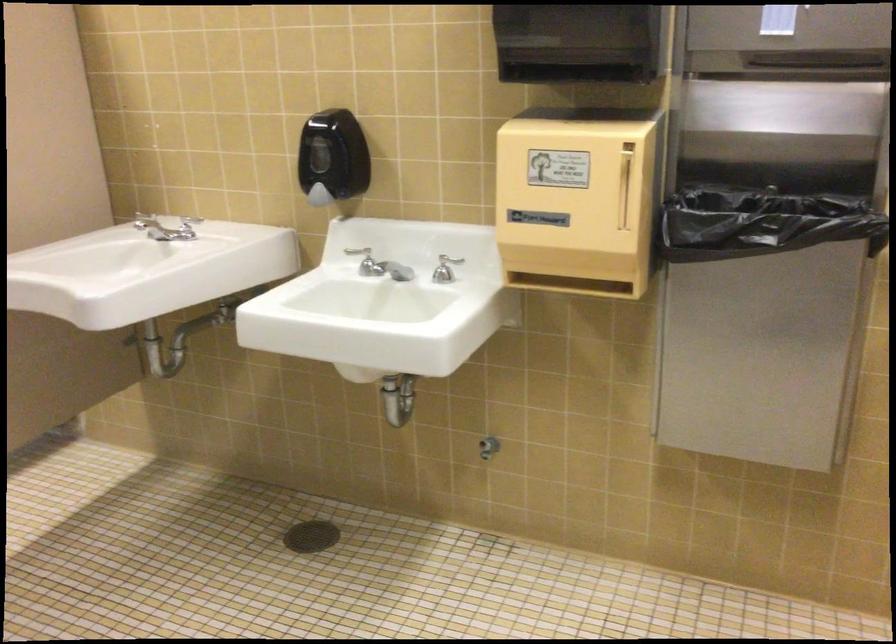
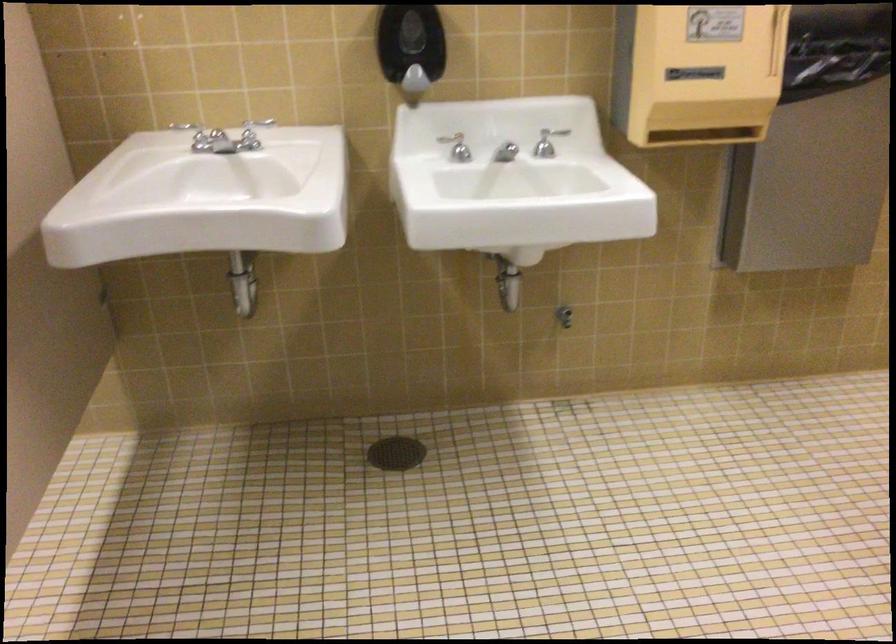
Locate, in the second image, the point that corresponds to the point at 317,532 in the first image.

(395, 453)